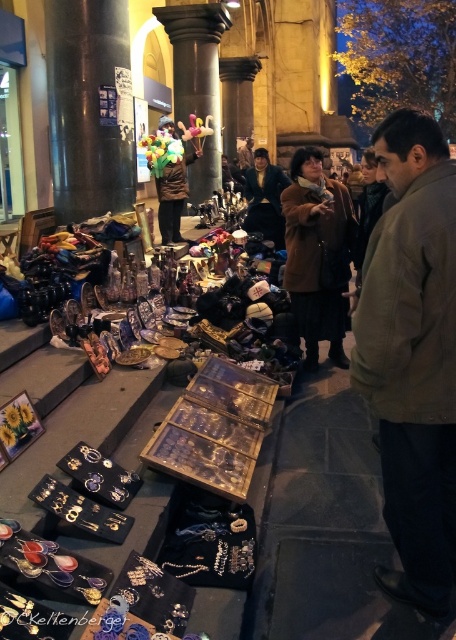
Which of these two, brown woolen jacket at right or velvet brown coat at center, stands taller?

With more height is brown woolen jacket at right.

Is point (442, 218) closer to viewer compared to point (257, 180)?

Yes, it is.

At what (x,y) coordinates should I click in order to perform the action: click on brown woolen jacket at right. Please return your answer as a coordinate pair (x, y). Looking at the image, I should click on (413, 356).